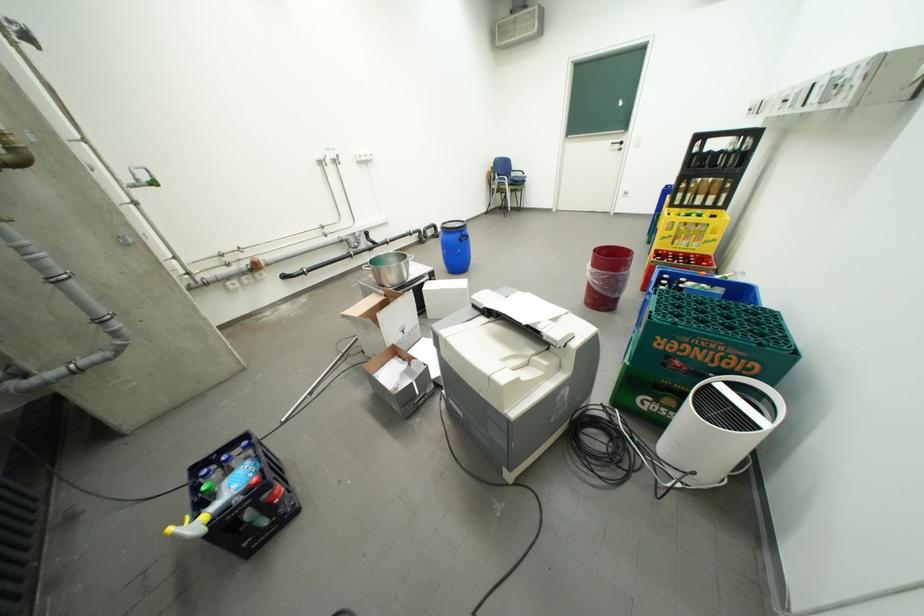
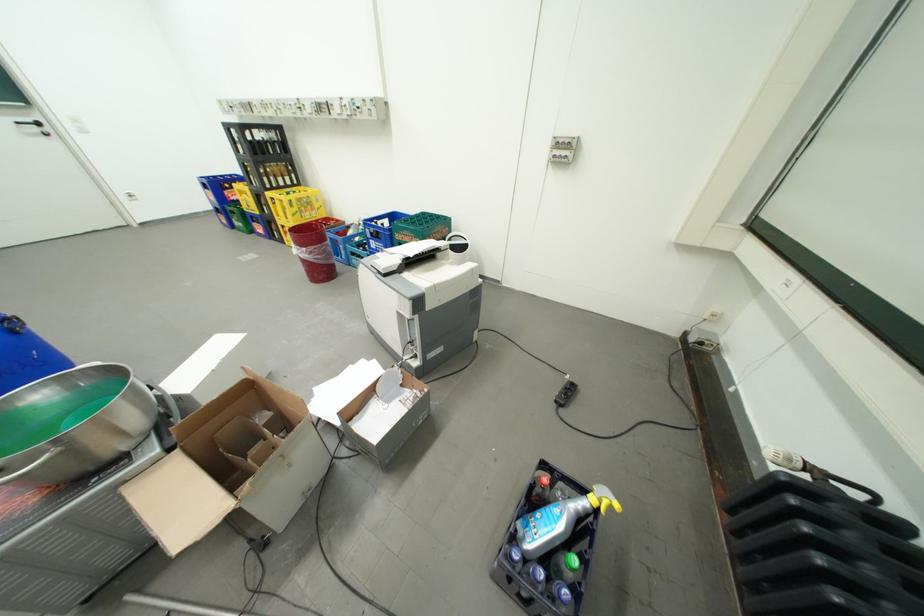
The point at (602, 269) is marked in the first image. Where is the corresponding point in the second image?

(314, 249)